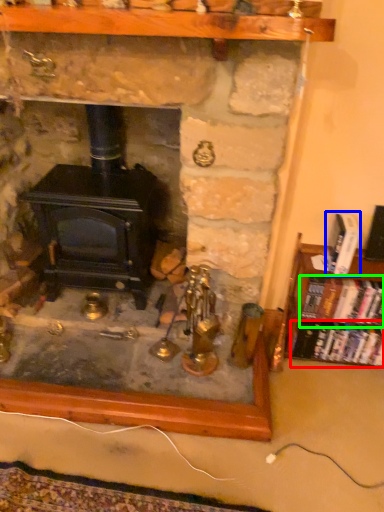
Question: Estimate the real-world distances between objects in this image. Which object is closer to book (highlighted by a red box), book (highlighted by a blue box) or book (highlighted by a green box)?

Choices:
 (A) book
 (B) book

Answer: (B)